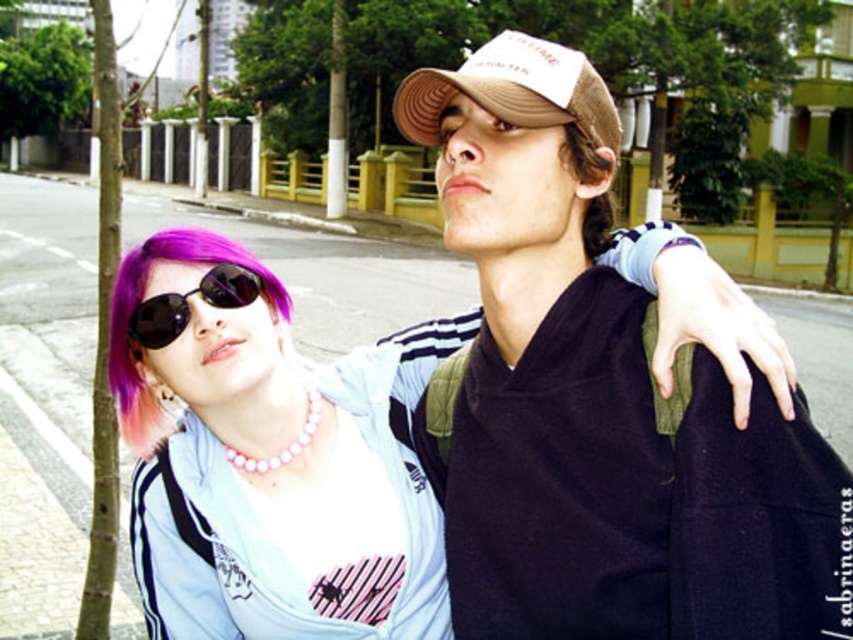
Question: Which of the following is the closest to the observer?

Choices:
 (A) brown matte hair at upper center
 (B) tan straw baseball hat at upper center
 (C) pearl necklace at center
 (D) brown mesh cap at upper center

Answer: (D)

Question: Does pink matte sunglasses at upper left have a larger size compared to brown matte hair at upper center?

Choices:
 (A) yes
 (B) no

Answer: (A)

Question: Based on their relative distances, which object is farther from the pearl necklace at center?

Choices:
 (A) pink matte sunglasses at upper left
 (B) brown matte hair at upper center
 (C) black reflective sunglasses at upper left

Answer: (B)

Question: From the image, what is the correct spatial relationship of pink matte sunglasses at upper left in relation to brown matte hair at upper center?

Choices:
 (A) below
 (B) above

Answer: (A)

Question: Observing the image, what is the correct spatial positioning of pearl necklace at center in reference to brown matte hair at upper center?

Choices:
 (A) left
 (B) right

Answer: (A)

Question: Based on their relative distances, which object is farther from the pink matte sunglasses at upper left?

Choices:
 (A) tan straw baseball hat at upper center
 (B) brown mesh cap at upper center
 (C) brown matte hair at upper center

Answer: (A)